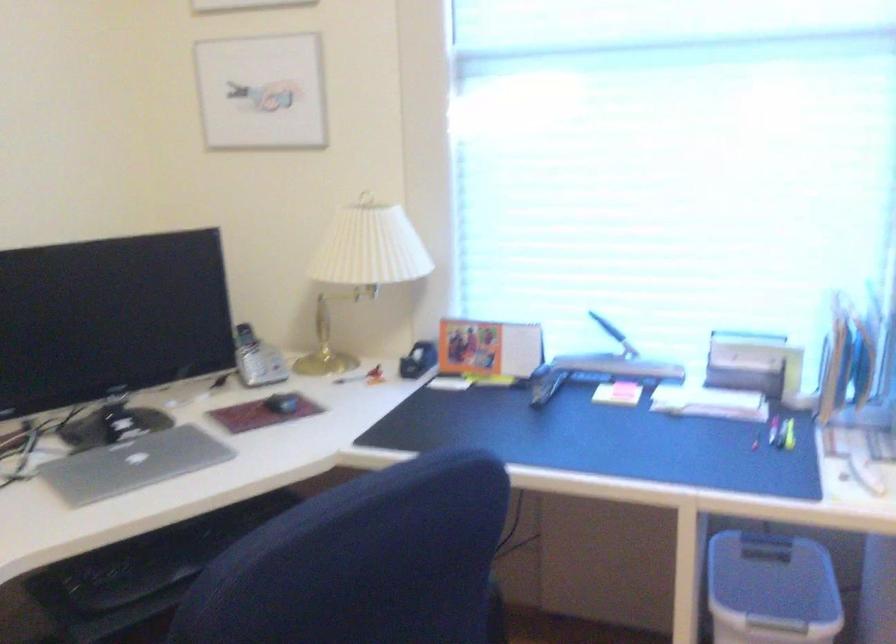
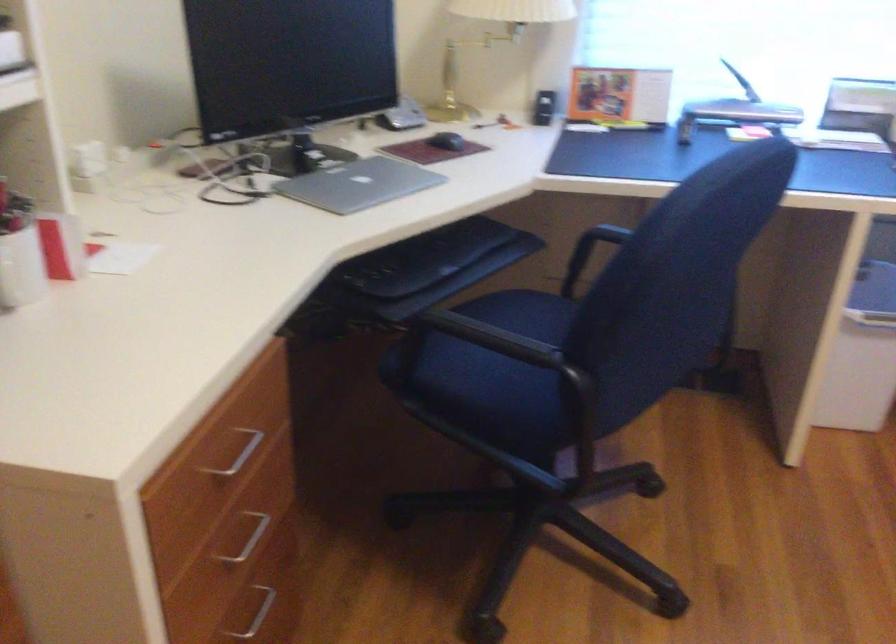
Locate, in the second image, the point that corresponds to point 272,406 in the first image.

(446, 140)